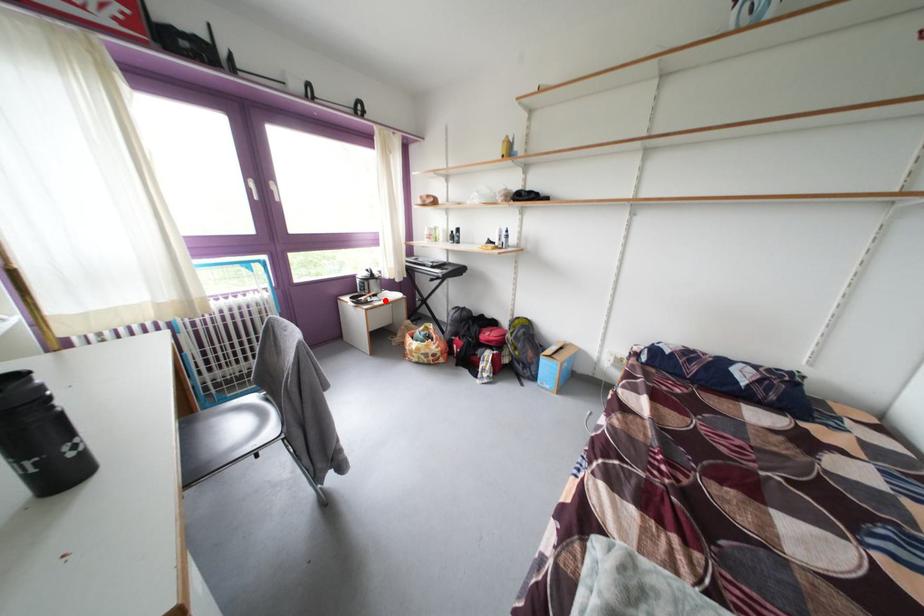
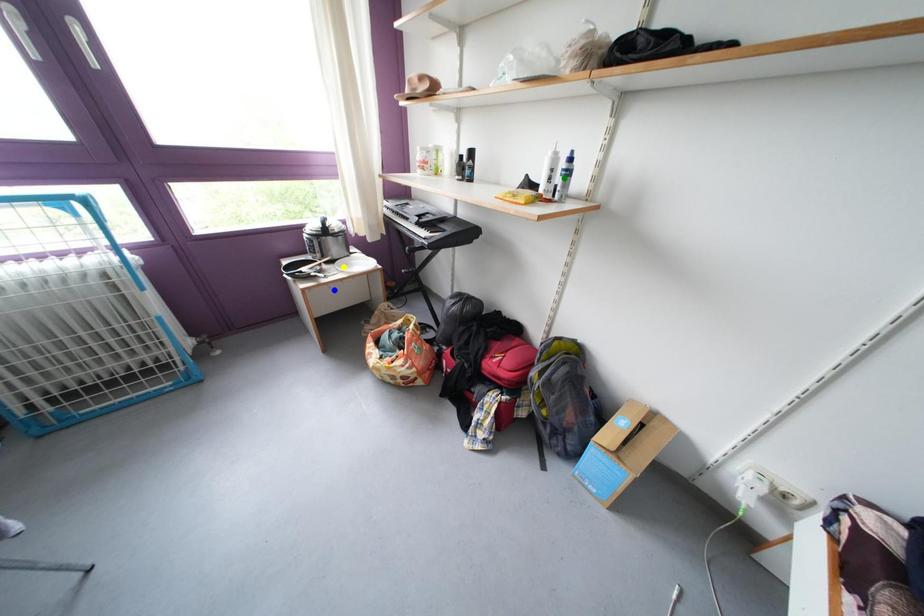
Question: I am providing you with two images of the same scene from different viewpoints. A red point is marked on the first image. You are given multiple points on the second image. Which mark in image 2 goes with the point in image 1?

Choices:
 (A) yellow point
 (B) blue point
 (C) green point

Answer: (A)